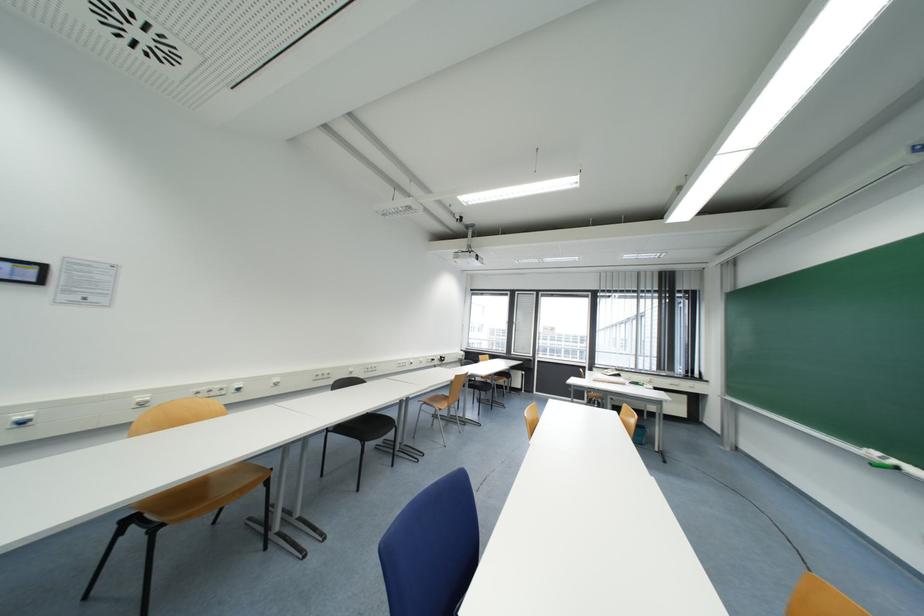
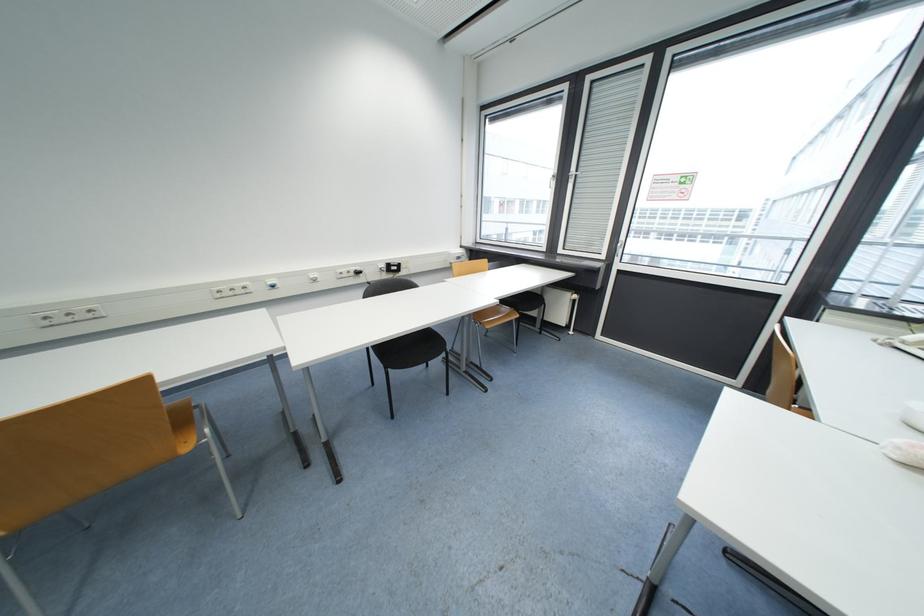
In the second image, find the point that corresponds to point (521, 294) in the first image.

(593, 81)